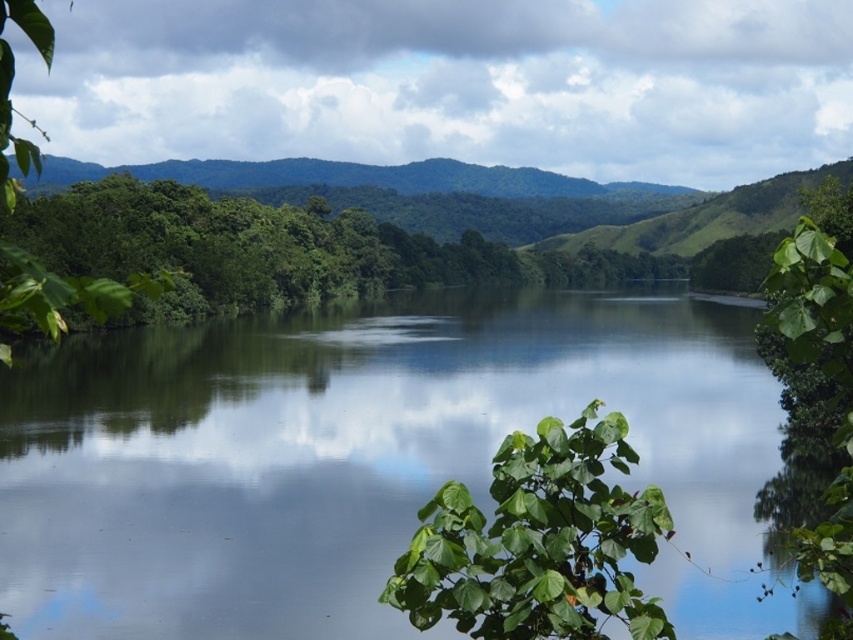
Question: Which object is closer to the camera taking this photo?

Choices:
 (A) green reflective water at center
 (B) green leafy plant at center

Answer: (B)

Question: Which point appears closest to the camera in this image?

Choices:
 (A) (694, 621)
 (B) (599, 634)

Answer: (B)

Question: Is green reflective water at center to the left of green leafy plant at center from the viewer's perspective?

Choices:
 (A) no
 (B) yes

Answer: (B)

Question: Does green reflective water at center have a larger size compared to green leafy plant at center?

Choices:
 (A) no
 (B) yes

Answer: (B)

Question: Which object is farther from the camera taking this photo?

Choices:
 (A) green leafy plant at center
 (B) green reflective water at center

Answer: (B)

Question: Is green reflective water at center below green leafy plant at center?

Choices:
 (A) no
 (B) yes

Answer: (A)